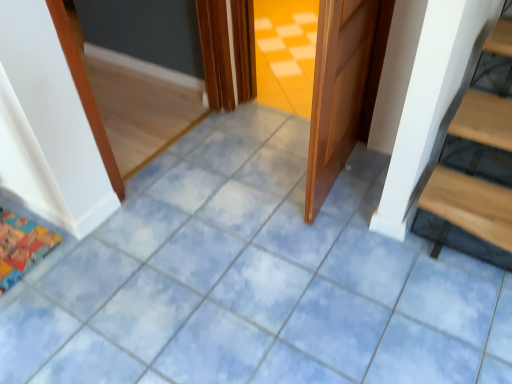
Question: Is brown wooden door at center not near cartoon fabric mat at lower left?

Choices:
 (A) no
 (B) yes

Answer: (B)

Question: Is brown wooden door at center not inside cartoon fabric mat at lower left?

Choices:
 (A) no
 (B) yes

Answer: (B)

Question: Is brown wooden door at center at the left side of cartoon fabric mat at lower left?

Choices:
 (A) no
 (B) yes

Answer: (A)

Question: Is the depth of brown wooden door at center greater than that of cartoon fabric mat at lower left?

Choices:
 (A) yes
 (B) no

Answer: (B)

Question: Considering the relative sizes of brown wooden door at center and cartoon fabric mat at lower left in the image provided, is brown wooden door at center smaller than cartoon fabric mat at lower left?

Choices:
 (A) no
 (B) yes

Answer: (A)

Question: From the image's perspective, is brown wooden door at center located beneath cartoon fabric mat at lower left?

Choices:
 (A) yes
 (B) no

Answer: (B)

Question: Does cartoon fabric mat at lower left have a lesser width compared to brown wooden door at center?

Choices:
 (A) no
 (B) yes

Answer: (A)

Question: From the image's perspective, is cartoon fabric mat at lower left below brown wooden door at center?

Choices:
 (A) yes
 (B) no

Answer: (A)

Question: Is cartoon fabric mat at lower left with brown wooden door at center?

Choices:
 (A) yes
 (B) no

Answer: (B)

Question: Considering the relative sizes of cartoon fabric mat at lower left and brown wooden door at center in the image provided, is cartoon fabric mat at lower left bigger than brown wooden door at center?

Choices:
 (A) no
 (B) yes

Answer: (A)

Question: Is cartoon fabric mat at lower left taller than brown wooden door at center?

Choices:
 (A) yes
 (B) no

Answer: (B)

Question: Is the position of cartoon fabric mat at lower left less distant than that of brown wooden door at center?

Choices:
 (A) no
 (B) yes

Answer: (A)

Question: From the image's perspective, relative to cartoon fabric mat at lower left, is brown wooden door at center above or below?

Choices:
 (A) below
 (B) above

Answer: (B)